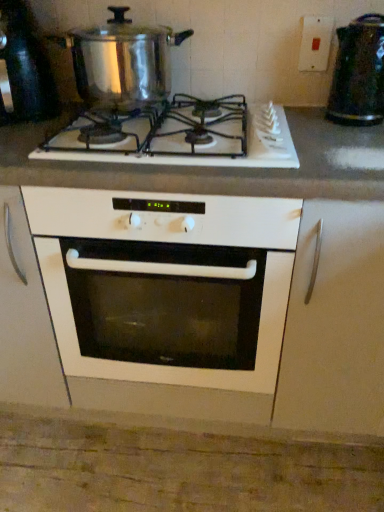
Question: Considering the relative positions of white plastic switch at upper right and shiny metallic pot at upper left, positioned as the 1th appliance in left-to-right order, in the image provided, is white plastic switch at upper right behind shiny metallic pot at upper left, positioned as the 1th appliance in left-to-right order,?

Choices:
 (A) yes
 (B) no

Answer: (A)

Question: Is white plastic switch at upper right at the right side of shiny metallic pot at upper left, positioned as the 1th appliance in left-to-right order?

Choices:
 (A) yes
 (B) no

Answer: (A)

Question: Is white plastic switch at upper right smaller than shiny metallic pot at upper left, which is counted as the 2th appliance, starting from the right?

Choices:
 (A) no
 (B) yes

Answer: (B)

Question: Would you say white plastic switch at upper right is outside shiny metallic pot at upper left, positioned as the 1th appliance in left-to-right order?

Choices:
 (A) no
 (B) yes

Answer: (B)

Question: Is white plastic switch at upper right taller than shiny metallic pot at upper left, positioned as the 1th appliance in left-to-right order?

Choices:
 (A) yes
 (B) no

Answer: (B)

Question: Considering the positions of shiny metallic pot at upper left and metallic textured kettle at upper right, the first appliance viewed from the right, in the image, is shiny metallic pot at upper left wider or thinner than metallic textured kettle at upper right, the first appliance viewed from the right,?

Choices:
 (A) thin
 (B) wide

Answer: (B)

Question: Considering the relative positions of shiny metallic pot at upper left and metallic textured kettle at upper right, acting as the second appliance starting from the left, in the image provided, is shiny metallic pot at upper left to the left or to the right of metallic textured kettle at upper right, acting as the second appliance starting from the left,?

Choices:
 (A) right
 (B) left

Answer: (B)

Question: Is shiny metallic pot at upper left in front of or behind metallic textured kettle at upper right, the first appliance viewed from the right, in the image?

Choices:
 (A) front
 (B) behind

Answer: (A)

Question: Is point (61, 38) closer or farther from the camera than point (354, 113)?

Choices:
 (A) closer
 (B) farther

Answer: (B)

Question: Looking at the image, does shiny metallic pot at upper left, positioned as the 1th appliance in left-to-right order, seem bigger or smaller compared to metallic textured kettle at upper right, acting as the second appliance starting from the left?

Choices:
 (A) small
 (B) big

Answer: (B)

Question: From a real-world perspective, relative to metallic textured kettle at upper right, the first appliance viewed from the right, is shiny metallic pot at upper left, which is counted as the 2th appliance, starting from the right, vertically above or below?

Choices:
 (A) above
 (B) below

Answer: (A)

Question: From the image's perspective, is shiny metallic pot at upper left, which is counted as the 2th appliance, starting from the right, above or below metallic textured kettle at upper right, the first appliance viewed from the right?

Choices:
 (A) above
 (B) below

Answer: (A)

Question: Looking at their shapes, would you say shiny metallic pot at upper left, which is counted as the 2th appliance, starting from the right, is wider or thinner than metallic textured kettle at upper right, acting as the second appliance starting from the left?

Choices:
 (A) wide
 (B) thin

Answer: (A)

Question: Is shiny metallic pot at upper left taller or shorter than white glossy countertop at center?

Choices:
 (A) short
 (B) tall

Answer: (A)

Question: Would you say shiny metallic pot at upper left is to the left or to the right of white glossy countertop at center in the picture?

Choices:
 (A) right
 (B) left

Answer: (B)